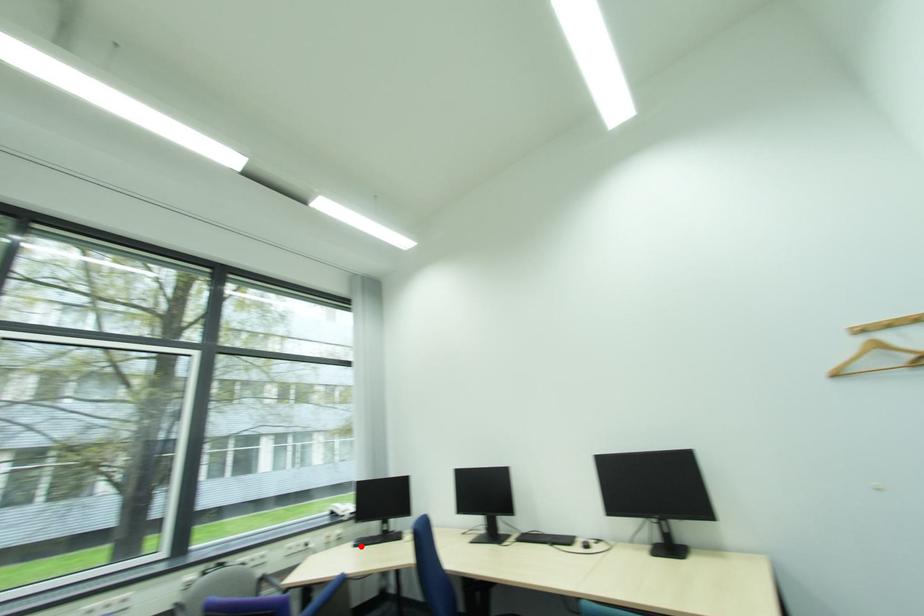
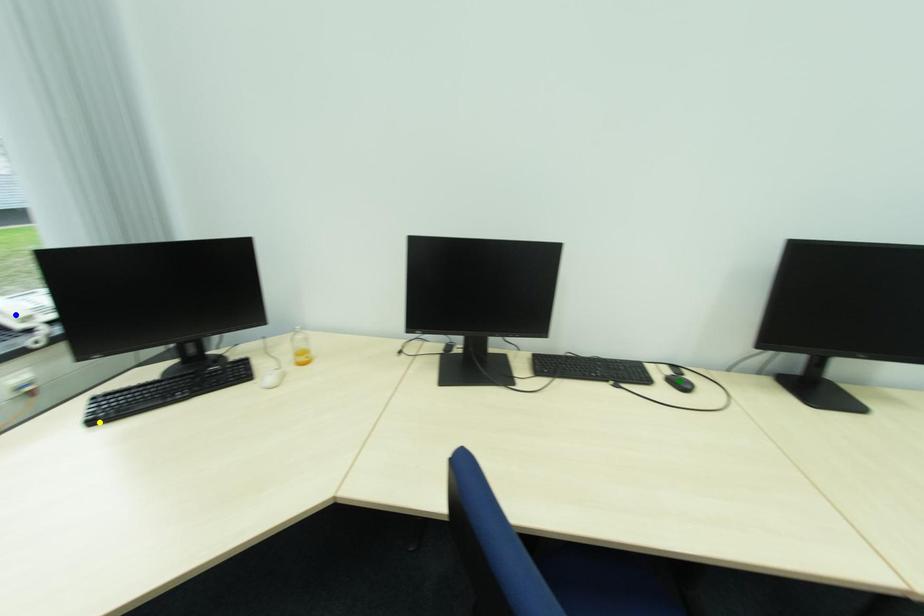
Question: I am providing you with two images of the same scene from different viewpoints. A red point is marked on the first image. You are given multiple points on the second image. Which mark in image 2 goes with the point in image 1?

Choices:
 (A) blue point
 (B) green point
 (C) yellow point

Answer: (C)